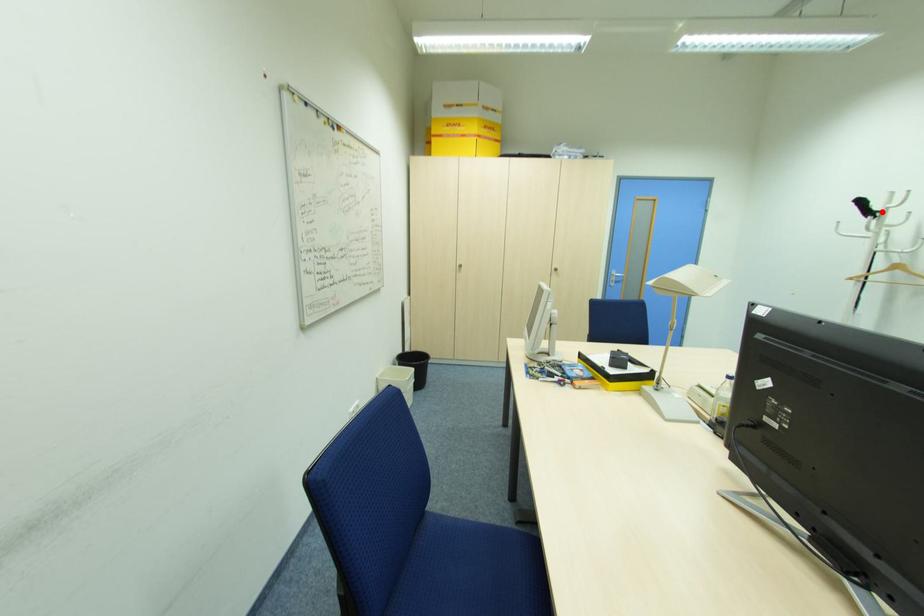
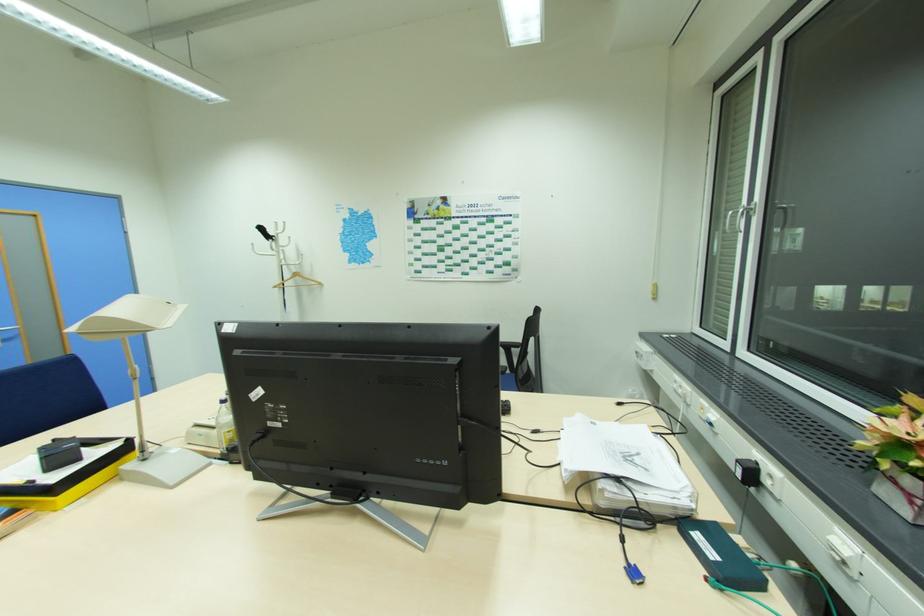
Where in the second image is the point corresponding to the highlighted location from the first image?

(276, 237)